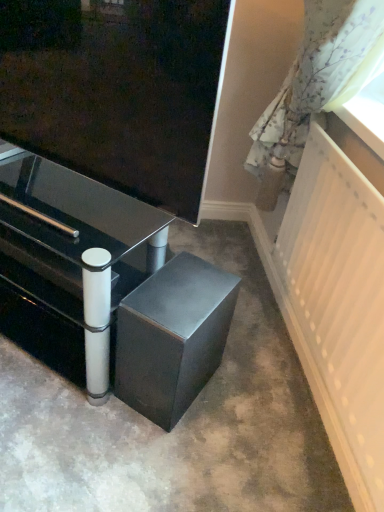
Describe the element at coordinates (317, 76) in the screenshot. I see `floral fabric curtain at right` at that location.

This screenshot has height=512, width=384. Find the location of `metallic black table at lower center`. metallic black table at lower center is located at coordinates (72, 247).

In order to face metallic black table at lower center, should I rotate leftwards or rightwards?

To face it directly, rotate left by 21.008 degrees.

Where is `satin black speaker at lower center`? This screenshot has width=384, height=512. satin black speaker at lower center is located at coordinates (172, 337).

Locate an element on the screen. This screenshot has width=384, height=512. floral fabric curtain at right is located at coordinates (317, 76).

At what (x,y) coordinates should I click in order to perform the action: click on drawer on the left of satin black speaker at lower center. Please return your answer as a coordinate pair (x, y). This screenshot has height=512, width=384. Looking at the image, I should click on (41, 274).

Looking at this image, from the image's perspective, between satin black speaker at lower center and white glossy drawer at lower left, who is located below?

satin black speaker at lower center.

Is white glossy drawer at lower left surrounded by satin black speaker at lower center?

No, satin black speaker at lower center does not contain white glossy drawer at lower left.

Is satin black speaker at lower center facing towards white glossy drawer at lower left?

No.

Which object is closer to the camera, white textured radiator at right or white glossy drawer at lower left?

Positioned in front is white textured radiator at right.

Is white textured radiator at right looking in the opposite direction of white glossy drawer at lower left?

No, white textured radiator at right is not facing away from white glossy drawer at lower left.

In the scene shown: Is white textured radiator at right placed right next to white glossy drawer at lower left?

No, white textured radiator at right is not with white glossy drawer at lower left.

Which of these two, white textured radiator at right or white glossy drawer at lower left, stands taller?

With more height is white textured radiator at right.

Is white glossy drawer at lower left far away from satin black speaker at lower center?

No, white glossy drawer at lower left is not far from satin black speaker at lower center.

Which of these two, white glossy drawer at lower left or satin black speaker at lower center, is smaller?

white glossy drawer at lower left is smaller.

Which point is more forward, (62, 270) or (163, 341)?

Point (163, 341)

Which of these two, white glossy drawer at lower left or floral fabric curtain at right, stands shorter?

Standing shorter between the two is white glossy drawer at lower left.

From the image's perspective, which object appears higher, white glossy drawer at lower left or floral fabric curtain at right?

floral fabric curtain at right is shown above in the image.

Which object is more forward, white glossy drawer at lower left or floral fabric curtain at right?

floral fabric curtain at right is more forward.

You are a GUI agent. You are given a task and a screenshot of the screen. Output one action in this format:
    pyautogui.click(x=<x>, y=<y>)
    Task: Click on the drawer lying behind the floral fabric curtain at right
    Image resolution: width=384 pixels, height=512 pixels.
    Given the screenshot: What is the action you would take?
    click(41, 274)

Does floral fabric curtain at right have a lesser width compared to white textured radiator at right?

Incorrect, the width of floral fabric curtain at right is not less than that of white textured radiator at right.

Which is more to the right, floral fabric curtain at right or white textured radiator at right?

From the viewer's perspective, white textured radiator at right appears more on the right side.

Looking at this image, is floral fabric curtain at right oriented towards white textured radiator at right?

No, floral fabric curtain at right is not oriented towards white textured radiator at right.

Is floral fabric curtain at right not close to white textured radiator at right?

Actually, floral fabric curtain at right and white textured radiator at right are a little close together.

Which is correct: white glossy drawer at lower left is inside white textured radiator at right, or outside of it?

white glossy drawer at lower left is not enclosed by white textured radiator at right.

Which of these two, white glossy drawer at lower left or white textured radiator at right, is smaller?

white glossy drawer at lower left is smaller.

Considering the sizes of white glossy drawer at lower left and white textured radiator at right in the image, is white glossy drawer at lower left wider or thinner than white textured radiator at right?

white glossy drawer at lower left is wider than white textured radiator at right.

Is white glossy drawer at lower left far from white textured radiator at right?

No, white glossy drawer at lower left is not far away from white textured radiator at right.

Considering the relative sizes of metallic black table at lower center and white textured radiator at right in the image provided, is metallic black table at lower center wider than white textured radiator at right?

Yes.

The width and height of the screenshot is (384, 512). Identify the location of radiator located on the right of metallic black table at lower center. (338, 305).

Can we say metallic black table at lower center lies outside white textured radiator at right?

Indeed, metallic black table at lower center is completely outside white textured radiator at right.

Measure the distance from metallic black table at lower center to white textured radiator at right.

metallic black table at lower center is 25.58 inches from white textured radiator at right.

You are a GUI agent. You are given a task and a screenshot of the screen. Output one action in this format:
    pyautogui.click(x=<x>, y=<y>)
    Task: Click on the furniture below the white glossy drawer at lower left (from a real-world perspective)
    The image size is (384, 512).
    Given the screenshot: What is the action you would take?
    pyautogui.click(x=172, y=337)

There is a white glossy drawer at lower left. Where is `radiator above it (from a real-world perspective)`? This screenshot has width=384, height=512. radiator above it (from a real-world perspective) is located at coordinates (338, 305).

When comparing their distances from floral fabric curtain at right, does satin black speaker at lower center or white textured radiator at right seem further?

satin black speaker at lower center lies further to floral fabric curtain at right than the other object.

Which object lies further to the anchor point white glossy drawer at lower left, white textured radiator at right or floral fabric curtain at right?

floral fabric curtain at right is positioned further to the anchor white glossy drawer at lower left.

Which object lies further to the anchor point metallic black table at lower center, satin black speaker at lower center or white textured radiator at right?

The object further to metallic black table at lower center is white textured radiator at right.

From the image, which object appears to be farther from white textured radiator at right, floral fabric curtain at right or satin black speaker at lower center?

Based on the image, satin black speaker at lower center appears to be further to white textured radiator at right.

Based on their spatial positions, is white glossy drawer at lower left or metallic black table at lower center closer to floral fabric curtain at right?

metallic black table at lower center is closer to floral fabric curtain at right.

Considering their positions, is floral fabric curtain at right positioned closer to white glossy drawer at lower left than satin black speaker at lower center?

satin black speaker at lower center lies closer to white glossy drawer at lower left than the other object.

Based on their spatial positions, is floral fabric curtain at right or satin black speaker at lower center closer to metallic black table at lower center?

The object closer to metallic black table at lower center is satin black speaker at lower center.

From the image, which object appears to be farther from metallic black table at lower center, floral fabric curtain at right or white glossy drawer at lower left?

floral fabric curtain at right is positioned further to the anchor metallic black table at lower center.

Identify the location of furniture between metallic black table at lower center and white textured radiator at right from left to right. (172, 337).

Image resolution: width=384 pixels, height=512 pixels. I want to click on furniture between metallic black table at lower center and floral fabric curtain at right from left to right, so click(x=172, y=337).

Identify the location of furniture between white glossy drawer at lower left and floral fabric curtain at right. The height and width of the screenshot is (512, 384). (172, 337).

At what (x,y) coordinates should I click in order to perform the action: click on drawer between metallic black table at lower center and white textured radiator at right in the horizontal direction. Please return your answer as a coordinate pair (x, y). This screenshot has height=512, width=384. Looking at the image, I should click on (41, 274).